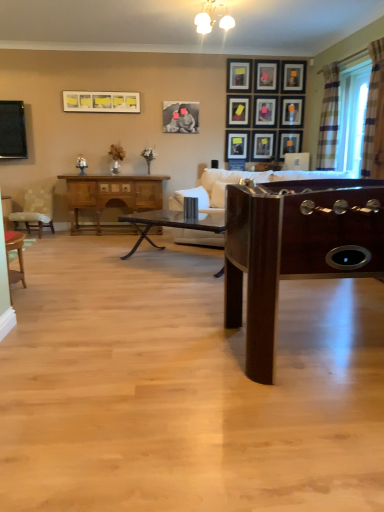
Question: Can you confirm if matte black television at left is wider than clear plastic window screen at right?

Choices:
 (A) no
 (B) yes

Answer: (A)

Question: Considering the relative positions of matte black television at left and clear plastic window screen at right in the image provided, is matte black television at left to the left of clear plastic window screen at right from the viewer's perspective?

Choices:
 (A) yes
 (B) no

Answer: (A)

Question: Considering the relative sizes of matte black television at left and clear plastic window screen at right in the image provided, is matte black television at left taller than clear plastic window screen at right?

Choices:
 (A) yes
 (B) no

Answer: (B)

Question: Is matte black television at left turned away from clear plastic window screen at right?

Choices:
 (A) yes
 (B) no

Answer: (B)

Question: Is matte black television at left positioned beyond the bounds of clear plastic window screen at right?

Choices:
 (A) yes
 (B) no

Answer: (A)

Question: From a real-world perspective, is matte black picture frame at upper right, the 1th picture frame when ordered from right to left, physically located above or below matte black picture frame at center, which is the sixth picture frame in right-to-left order?

Choices:
 (A) above
 (B) below

Answer: (A)

Question: Which is correct: matte black picture frame at upper right, the 1th picture frame when ordered from right to left, is inside matte black picture frame at center, the 5th picture frame positioned from the left, or outside of it?

Choices:
 (A) inside
 (B) outside

Answer: (B)

Question: Considering the positions of matte black picture frame at upper right, the 1th picture frame when ordered from right to left, and matte black picture frame at center, which is the sixth picture frame in right-to-left order, in the image, is matte black picture frame at upper right, the 1th picture frame when ordered from right to left, bigger or smaller than matte black picture frame at center, which is the sixth picture frame in right-to-left order,?

Choices:
 (A) small
 (B) big

Answer: (A)

Question: Considering the positions of matte black picture frame at upper right, the 1th picture frame when ordered from right to left, and matte black picture frame at center, which is the sixth picture frame in right-to-left order, in the image, is matte black picture frame at upper right, the 1th picture frame when ordered from right to left, wider or thinner than matte black picture frame at center, which is the sixth picture frame in right-to-left order,?

Choices:
 (A) thin
 (B) wide

Answer: (A)

Question: Does point (291, 132) appear closer or farther from the camera than point (231, 148)?

Choices:
 (A) closer
 (B) farther

Answer: (B)

Question: Is matte black picture frame at upper center, the 9th picture frame viewed from the left, taller or shorter than matte black picture frame at upper center, which appears as the second picture frame when viewed from the left?

Choices:
 (A) short
 (B) tall

Answer: (B)

Question: Considering the positions of matte black picture frame at upper center, the 9th picture frame viewed from the left, and matte black picture frame at upper center, the 9th picture frame when ordered from right to left, in the image, is matte black picture frame at upper center, the 9th picture frame viewed from the left, wider or thinner than matte black picture frame at upper center, the 9th picture frame when ordered from right to left,?

Choices:
 (A) wide
 (B) thin

Answer: (B)

Question: From a real-world perspective, is matte black picture frame at upper center, which appears as the second picture frame when viewed from the right, above or below matte black picture frame at upper center, which appears as the second picture frame when viewed from the left?

Choices:
 (A) below
 (B) above

Answer: (B)

Question: Relative to wooden cabinet at left, is white glossy light fixture at upper center in front or behind?

Choices:
 (A) front
 (B) behind

Answer: (A)

Question: From the image's perspective, relative to wooden cabinet at left, is white glossy light fixture at upper center above or below?

Choices:
 (A) below
 (B) above

Answer: (B)